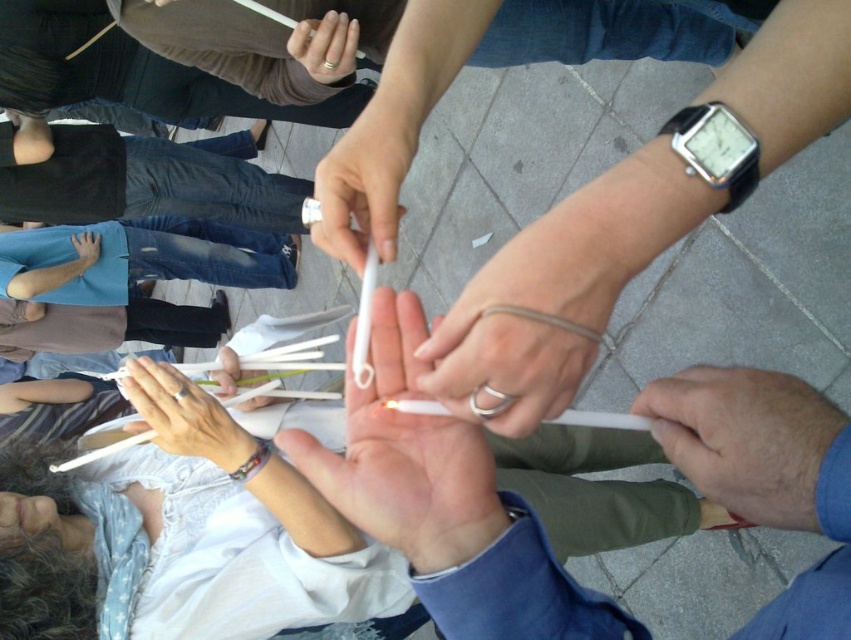
Question: Does white plastic pen at center appear on the right side of matte silver ring at center?

Choices:
 (A) no
 (B) yes

Answer: (B)

Question: Does white matte cigarette at center appear under smooth white pen at center?

Choices:
 (A) yes
 (B) no

Answer: (A)

Question: Which point is farther from the camera taking this photo?

Choices:
 (A) (740, 477)
 (B) (443, 490)
 (C) (210, 412)

Answer: (C)

Question: Among these points, which one is nearest to the camera?

Choices:
 (A) (520, 380)
 (B) (236, 355)
 (C) (167, 403)
 (D) (340, 248)

Answer: (A)

Question: Can you confirm if white matte cigarette at center is bigger than smooth white pen at center?

Choices:
 (A) yes
 (B) no

Answer: (A)

Question: Which object is the closest to the white matte chopsticks at center?

Choices:
 (A) smooth white pen at center
 (B) white matte cigarette at center
 (C) smooth skin hand at center
 (D) white matte chopsticks at lower left

Answer: (D)